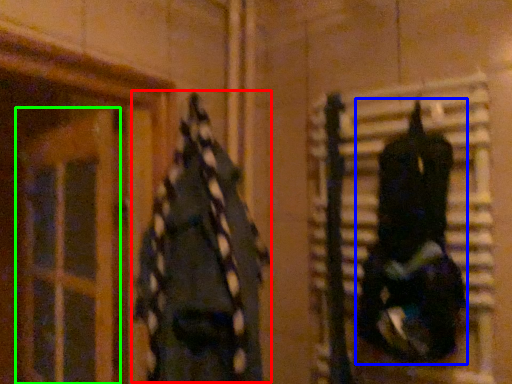
Question: Which object is the farthest from clothing (highlighted by a red box)? Choose among these: clothing (highlighted by a blue box) or glass door (highlighted by a green box).

Choices:
 (A) clothing
 (B) glass door

Answer: (A)